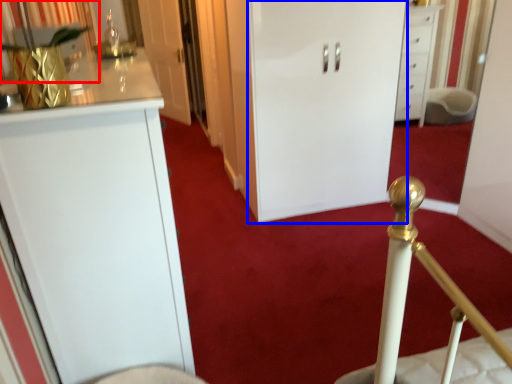
Question: Which of the following is the closest to the observer, curtain (highlighted by a red box) or door (highlighted by a blue box)?

Choices:
 (A) curtain
 (B) door

Answer: (A)